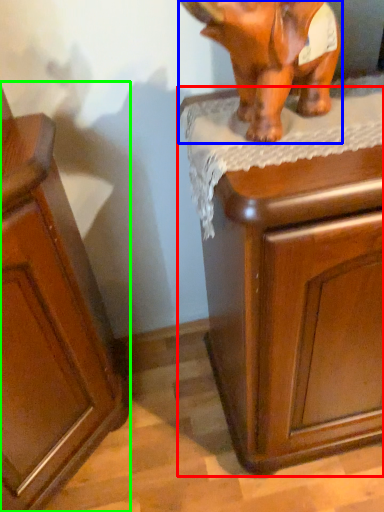
Question: Based on their relative distances, which object is farther from chest of drawers (highlighted by a red box)? Choose from elephant (highlighted by a blue box) and cabinetry (highlighted by a green box).

Choices:
 (A) elephant
 (B) cabinetry

Answer: (B)